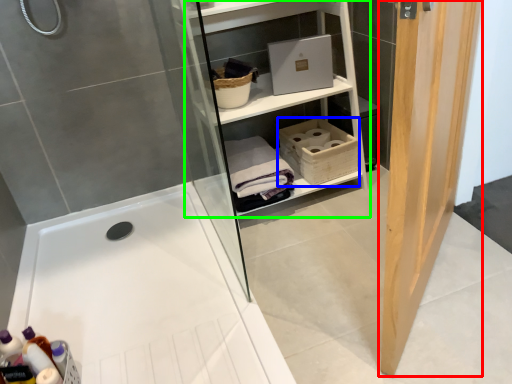
Question: Considering the real-world distances, which object is closest to door (highlighted by a red box)? basket (highlighted by a blue box) or shelf (highlighted by a green box).

Choices:
 (A) basket
 (B) shelf

Answer: (B)